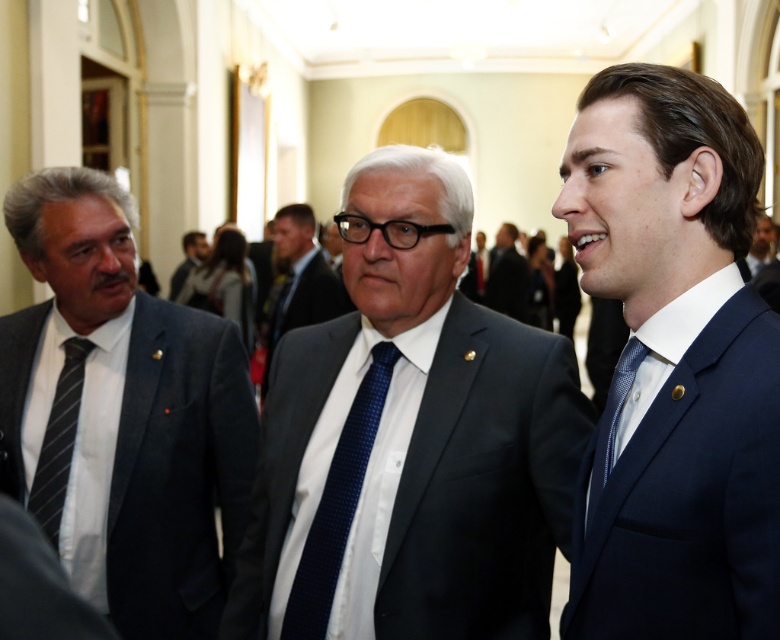
Question: Does blue dotted fabric tie at right appear on the left side of dark blue suit at right?

Choices:
 (A) yes
 (B) no

Answer: (A)

Question: Is black striped tie at left bigger than dark blue suit at right?

Choices:
 (A) no
 (B) yes

Answer: (A)

Question: Which is nearer to the dark blue suit at right?

Choices:
 (A) navy blue suit at right
 (B) blue dotted fabric tie at right
 (C) matte black suit at left

Answer: (C)

Question: Which of these objects is positioned closest to the matte black suit at left?

Choices:
 (A) black striped tie at left
 (B) navy blue suit at right

Answer: (A)

Question: Which object appears farthest from the camera in this image?

Choices:
 (A) navy blue suit at right
 (B) matte black suit at left
 (C) blue dotted fabric tie at right
 (D) matte black suit at center

Answer: (B)

Question: Is dark blue suit at center above light brown leather jacket at center?

Choices:
 (A) yes
 (B) no

Answer: (B)